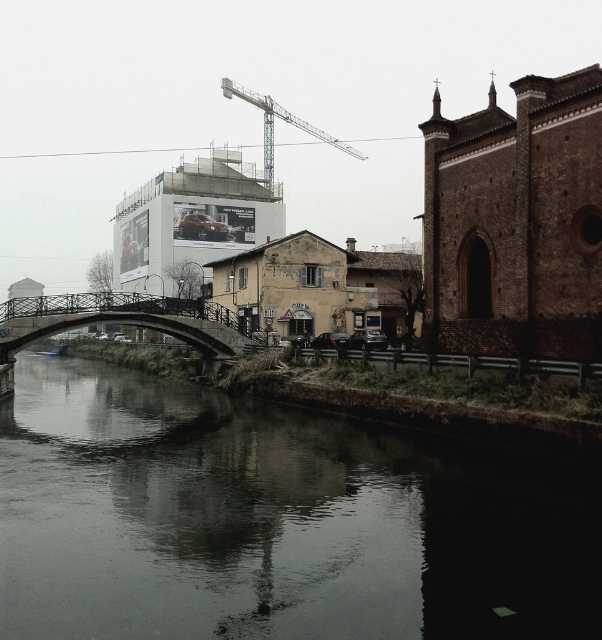
Question: Is dark reflective water at center in front of metallic gray crane at upper center?

Choices:
 (A) no
 (B) yes

Answer: (B)

Question: Which of these objects is positioned closest to the metallic gray crane at upper center?

Choices:
 (A) dark reflective water at center
 (B) metallic bridge at center

Answer: (B)

Question: Can you confirm if metallic bridge at center is smaller than metallic gray crane at upper center?

Choices:
 (A) no
 (B) yes

Answer: (B)

Question: Estimate the real-world distances between objects in this image. Which object is closer to the metallic bridge at center?

Choices:
 (A) dark reflective water at center
 (B) metallic gray crane at upper center

Answer: (A)

Question: Among these points, which one is farthest from the camera?

Choices:
 (A) (326, 582)
 (B) (11, 346)

Answer: (B)

Question: Does metallic bridge at center appear over metallic gray crane at upper center?

Choices:
 (A) no
 (B) yes

Answer: (A)